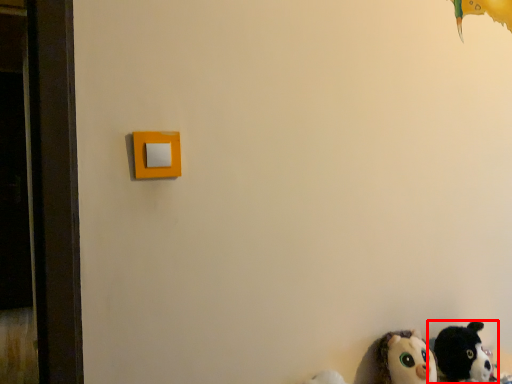
Question: From the image's perspective, what is the correct spatial positioning of toy (annotated by the red box) in reference to toy?

Choices:
 (A) above
 (B) below

Answer: (A)